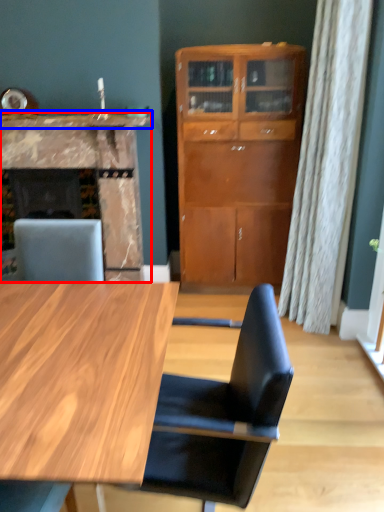
Question: Which of the following is the farthest to the observer, fireplace (highlighted by a red box) or counter top (highlighted by a blue box)?

Choices:
 (A) fireplace
 (B) counter top

Answer: (A)